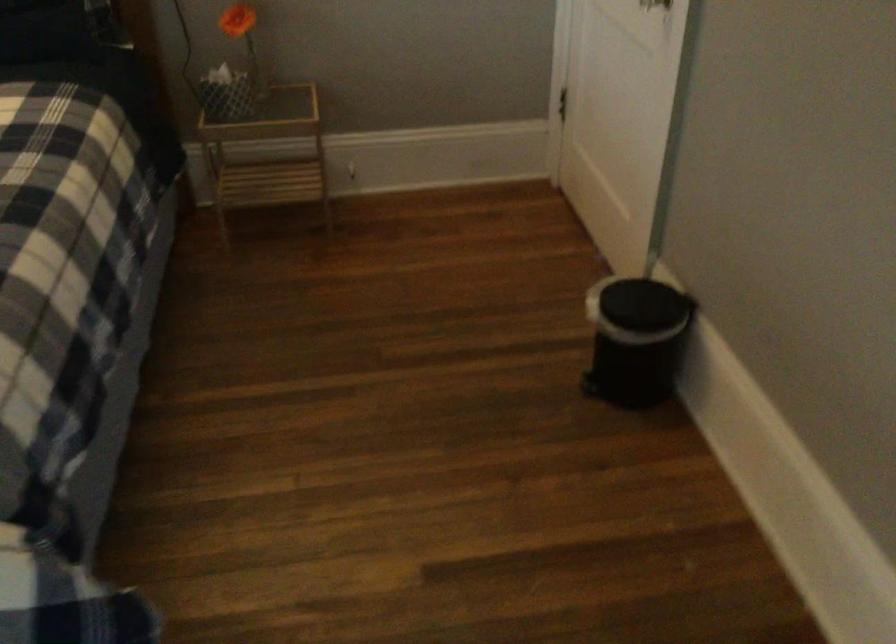
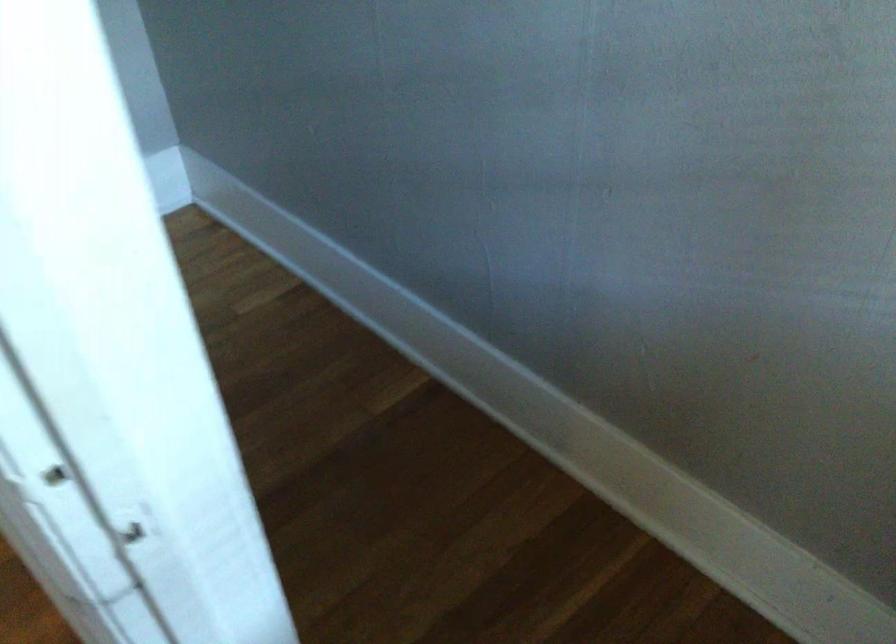
Question: Based on the continuous images, in which direction is the camera rotating? Reply with the corresponding letter.

Choices:
 (A) Left
 (B) Right
 (C) Up
 (D) Down

Answer: (B)